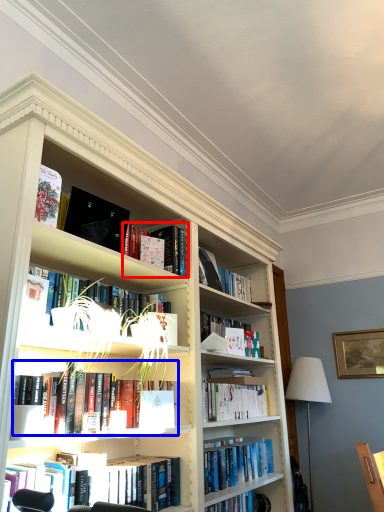
Question: Which object appears farthest to the camera in this image, book (highlighted by a red box) or book (highlighted by a blue box)?

Choices:
 (A) book
 (B) book

Answer: (A)